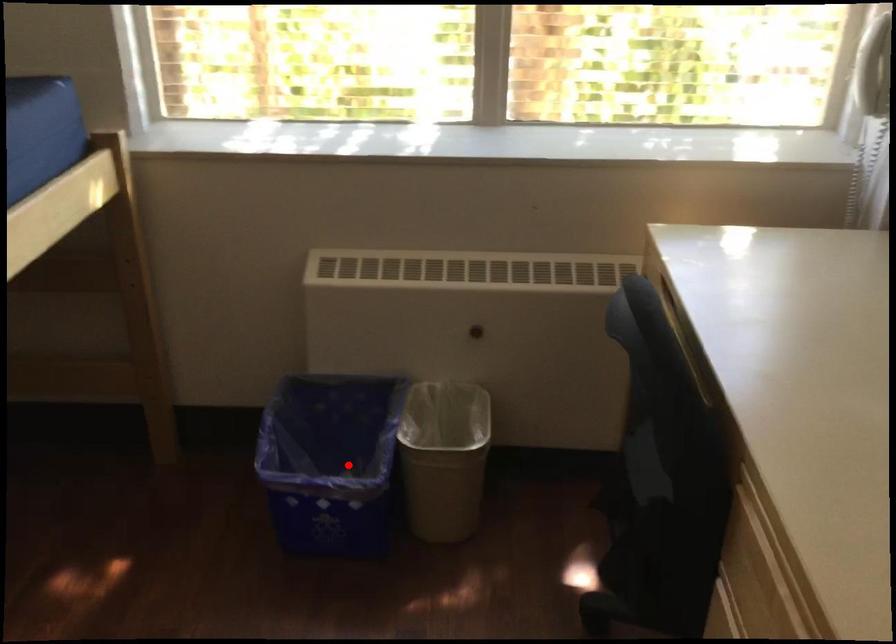
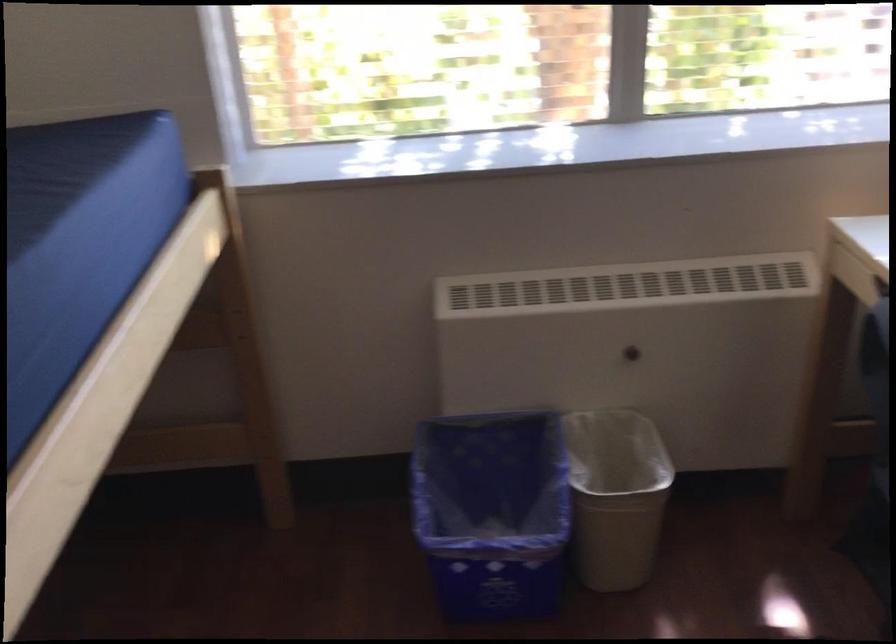
In the second image, find the point that corresponds to the highlighted location in the first image.

(492, 512)